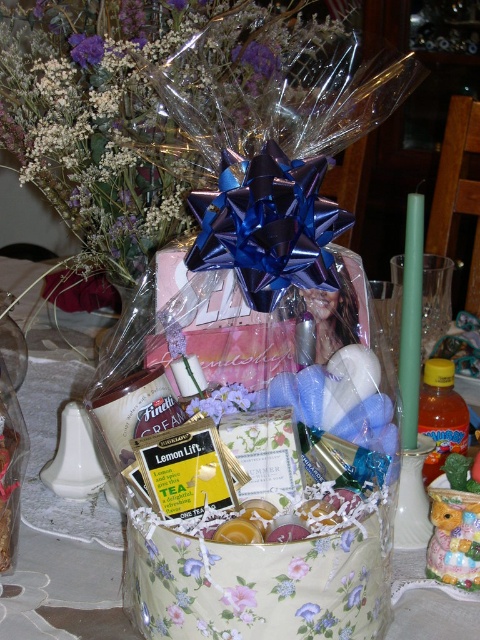
Question: Is purple floral bouquet at upper left in front of purple floral paper at center?

Choices:
 (A) yes
 (B) no

Answer: (B)

Question: Which is nearer to the purple floral bouquet at center?

Choices:
 (A) pink fabric flower at center
 (B) floral paper at lower center

Answer: (B)

Question: Does floral paper at lower center appear on the left side of purple floral paper at center?

Choices:
 (A) yes
 (B) no

Answer: (A)

Question: Considering the real-world distances, which object is farthest from the floral-patterned fabric basket at center?

Choices:
 (A) purple floral bouquet at upper left
 (B) pink fabric flower at center
 (C) purple floral paper at center
 (D) purple floral bouquet at center

Answer: (A)

Question: Does floral-patterned fabric basket at center appear under pink fabric flower at center?

Choices:
 (A) yes
 (B) no

Answer: (B)

Question: Which object is the closest to the purple floral bouquet at center?

Choices:
 (A) floral-patterned fabric basket at center
 (B) translucent plastic bouquet at upper center
 (C) floral paper at lower center
 (D) purple floral bouquet at upper left

Answer: (C)